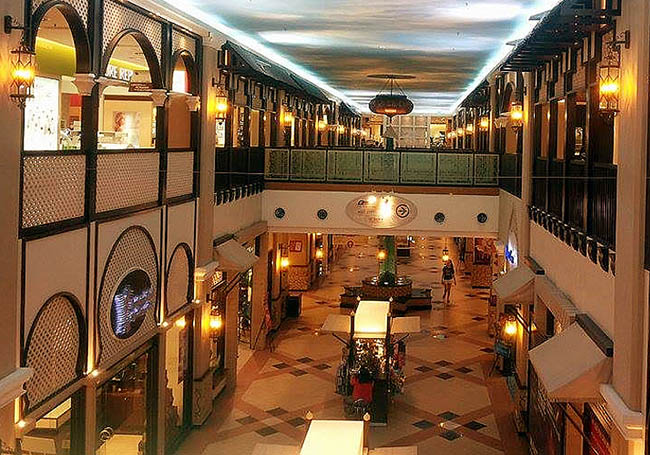
This screenshot has width=650, height=455. I want to click on light, so click(602, 87).